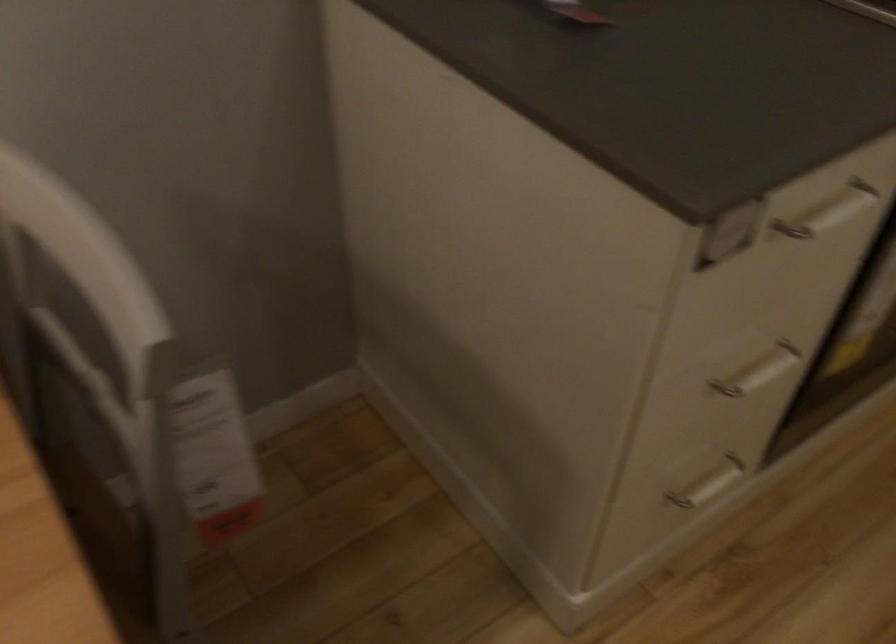
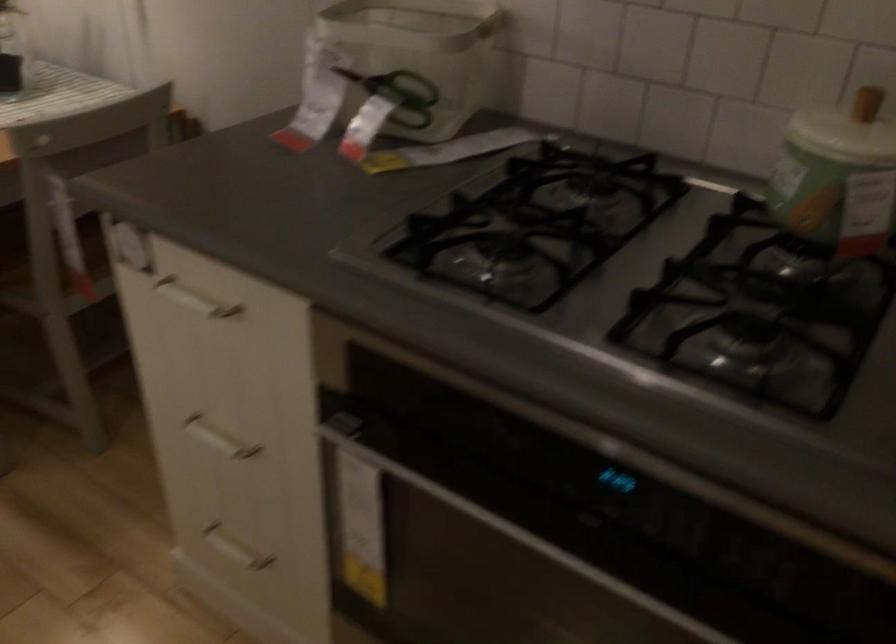
The point at (677, 512) is marked in the first image. Where is the corresponding point in the second image?

(234, 549)